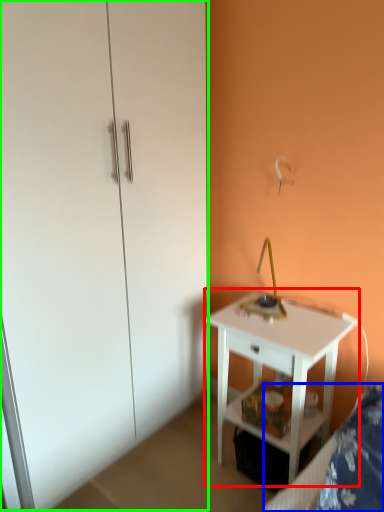
Question: Which object is the closest to the nightstand (highlighted by a red box)? Choose among these: bed frame (highlighted by a blue box) or dresser (highlighted by a green box).

Choices:
 (A) bed frame
 (B) dresser

Answer: (A)